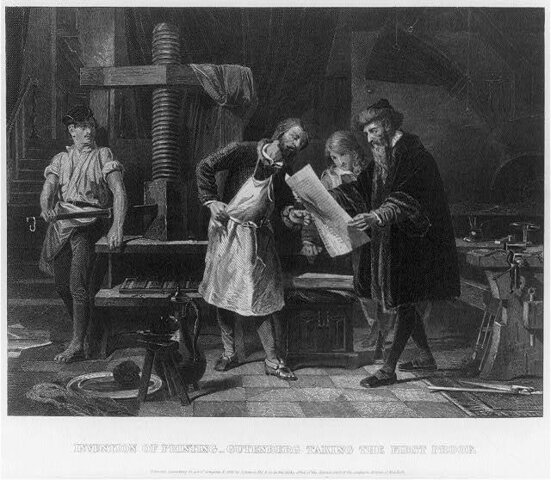
Where is `floor`? Image resolution: width=551 pixels, height=480 pixels. floor is located at coordinates 290,393.